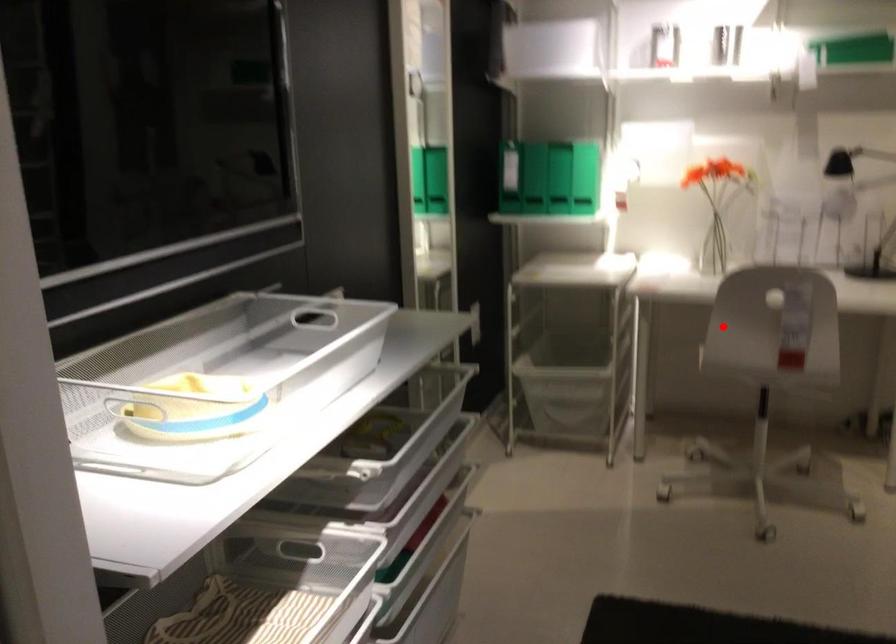
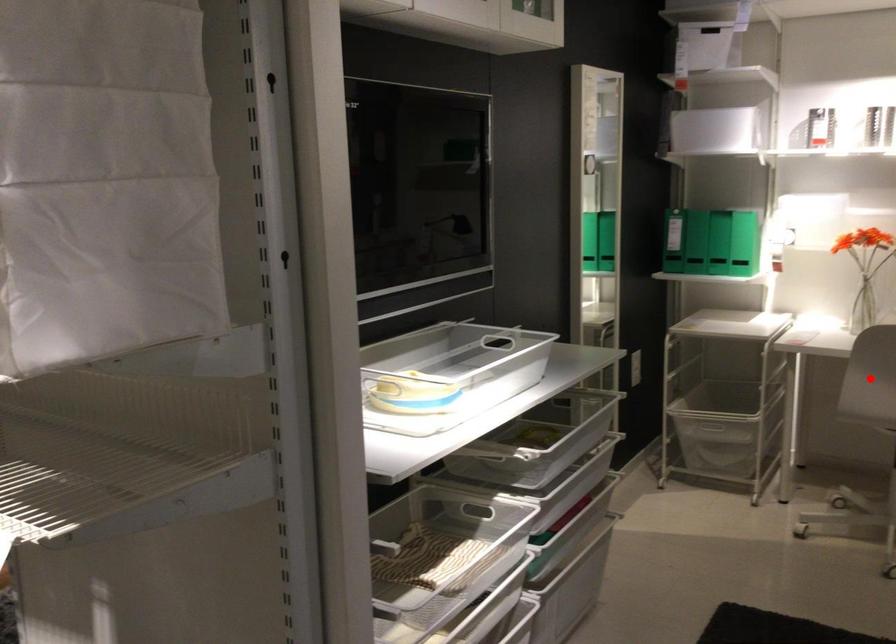
I am providing you with two images of the same scene from different viewpoints. A red point is marked on the first image and another point is marked on the second image. Is the red point in image1 aligned with the point shown in image2?

Yes